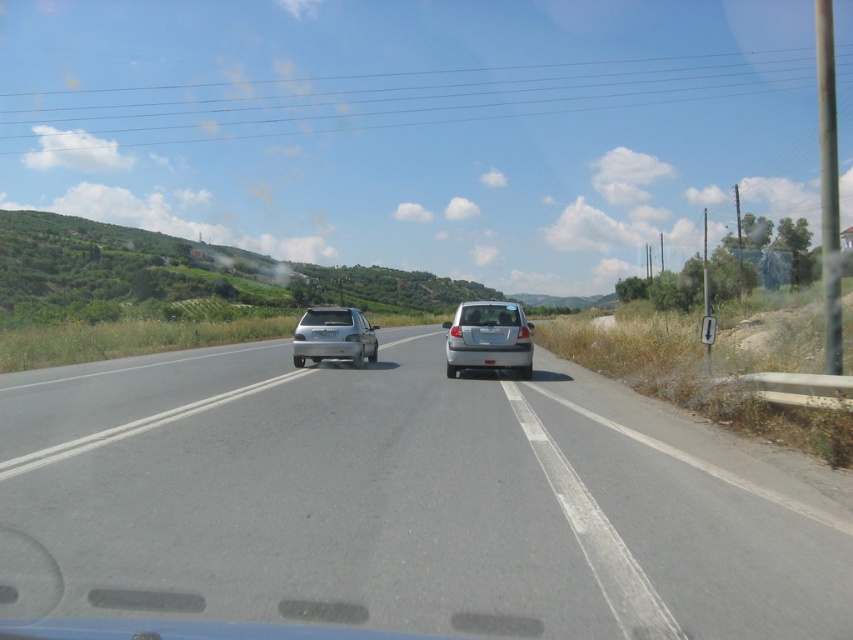
Which of these two, gray asphalt road at center or white plastic license plate at center, stands shorter?

white plastic license plate at center is shorter.

Can you confirm if gray asphalt road at center is bigger than white plastic license plate at center?

Correct, gray asphalt road at center is larger in size than white plastic license plate at center.

Which is behind, point (279, 593) or point (312, 330)?

The point (312, 330) is more distant.

Image resolution: width=853 pixels, height=640 pixels. Identify the location of gray asphalt road at center. coord(402,502).

From the picture: Is satin silver suv at center thinner than white plastic license plate at center?

No.

Describe the element at coordinates (334, 337) in the screenshot. The height and width of the screenshot is (640, 853). I see `satin silver suv at center` at that location.

Describe the element at coordinates (334, 337) in the screenshot. I see `satin silver suv at center` at that location.

Image resolution: width=853 pixels, height=640 pixels. I want to click on satin silver suv at center, so click(x=334, y=337).

Does silver metallic car at center appear under satin silver suv at center?

Correct, silver metallic car at center is located below satin silver suv at center.

Based on the photo, between silver metallic car at center and satin silver suv at center, which one has less height?

satin silver suv at center is shorter.

Is point (509, 307) positioned before point (309, 308)?

Yes, it is in front of point (309, 308).

The height and width of the screenshot is (640, 853). What are the coordinates of `silver metallic car at center` in the screenshot? It's located at [488, 339].